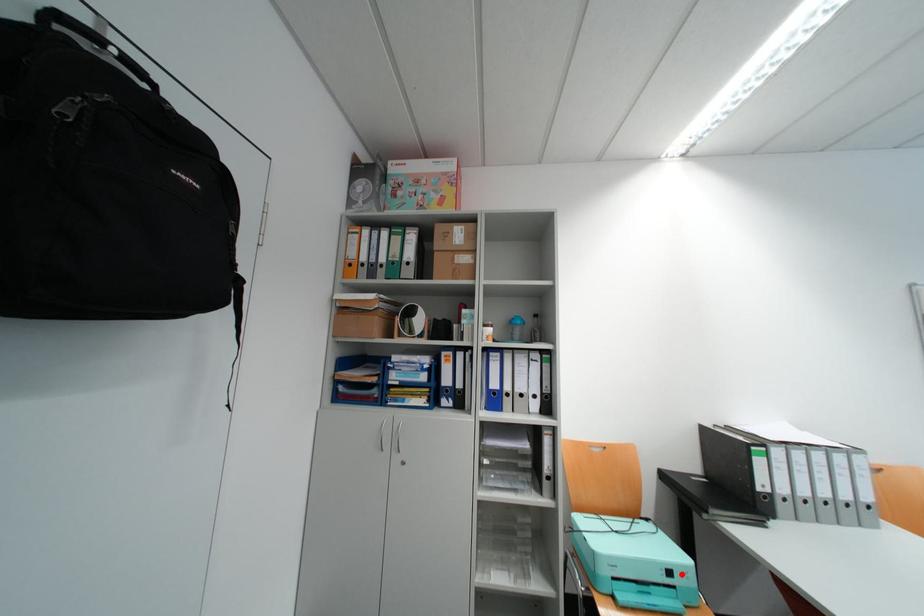
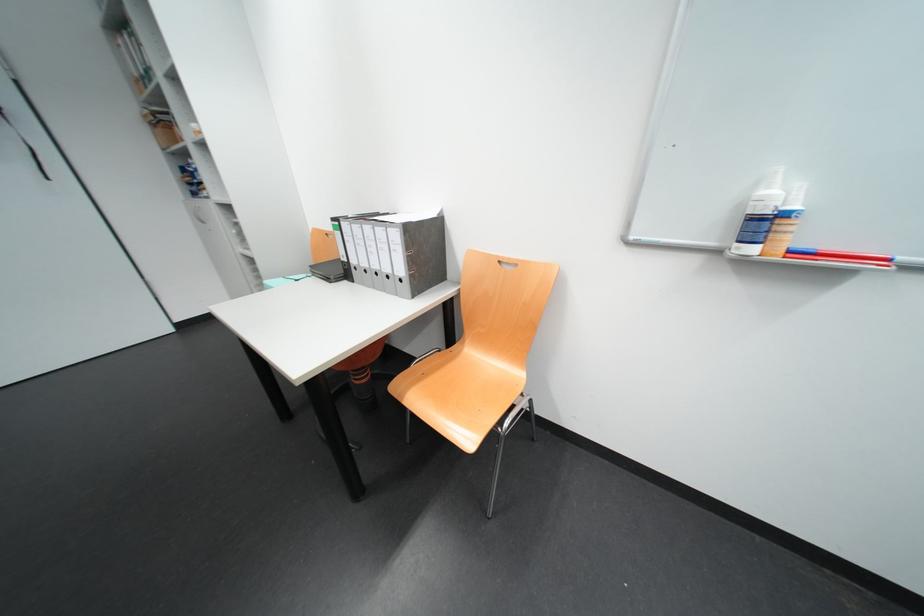
Question: I am providing you with two images of the same scene from different viewpoints. A red point is marked on the first image. Can you still see the location of the red point in image 2?

Choices:
 (A) Yes
 (B) No

Answer: (B)